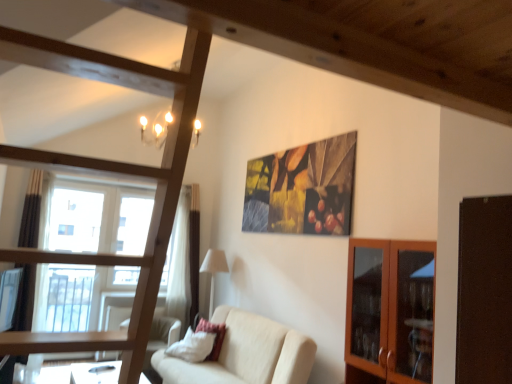
Question: From the image's perspective, is wooden glass cabinet at right on top of white fabric lampshade at center?

Choices:
 (A) no
 (B) yes

Answer: (B)

Question: Is wooden glass cabinet at right next to white fabric lampshade at center and touching it?

Choices:
 (A) no
 (B) yes

Answer: (A)

Question: From a real-world perspective, is wooden glass cabinet at right physically below white fabric lampshade at center?

Choices:
 (A) yes
 (B) no

Answer: (B)

Question: Considering the relative positions of wooden glass cabinet at right and white fabric lampshade at center in the image provided, is wooden glass cabinet at right to the right of white fabric lampshade at center from the viewer's perspective?

Choices:
 (A) no
 (B) yes

Answer: (B)

Question: Can you confirm if wooden glass cabinet at right is thinner than white fabric lampshade at center?

Choices:
 (A) no
 (B) yes

Answer: (A)

Question: Is wooden glass cabinet at right not close to white fabric lampshade at center?

Choices:
 (A) yes
 (B) no

Answer: (A)

Question: Is wooden frame bunk bed at center with wooden glass cabinet at right?

Choices:
 (A) no
 (B) yes

Answer: (A)

Question: Can you confirm if wooden frame bunk bed at center is wider than wooden glass cabinet at right?

Choices:
 (A) yes
 (B) no

Answer: (A)

Question: Is wooden frame bunk bed at center smaller than wooden glass cabinet at right?

Choices:
 (A) no
 (B) yes

Answer: (A)

Question: Is wooden frame bunk bed at center thinner than wooden glass cabinet at right?

Choices:
 (A) yes
 (B) no

Answer: (B)

Question: Is wooden glass cabinet at right at the back of wooden frame bunk bed at center?

Choices:
 (A) yes
 (B) no

Answer: (B)

Question: Considering the relative positions of wooden frame bunk bed at center and wooden glass cabinet at right in the image provided, is wooden frame bunk bed at center to the left of wooden glass cabinet at right from the viewer's perspective?

Choices:
 (A) no
 (B) yes

Answer: (B)

Question: Is beige fabric couch at center positioned with its back to wooden frame bunk bed at center?

Choices:
 (A) no
 (B) yes

Answer: (A)